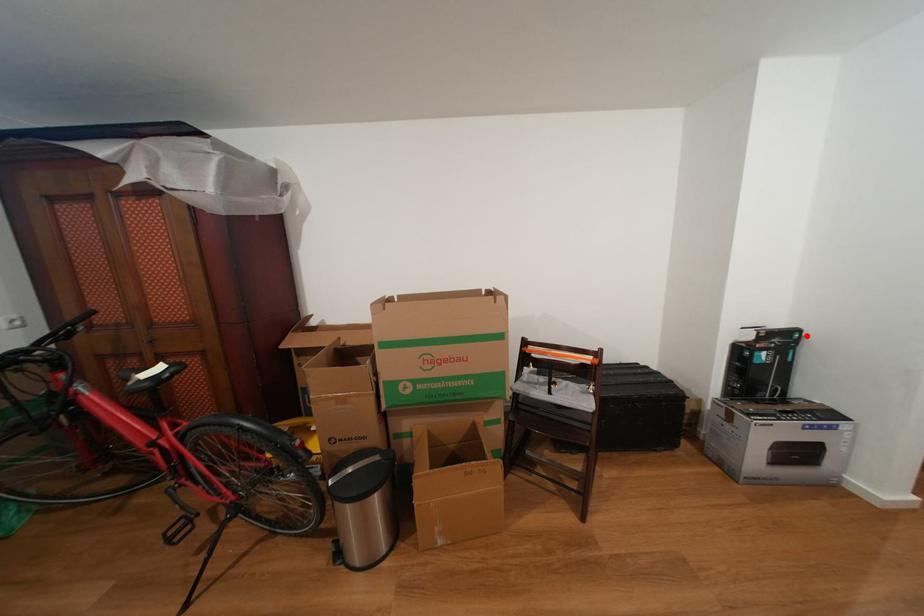
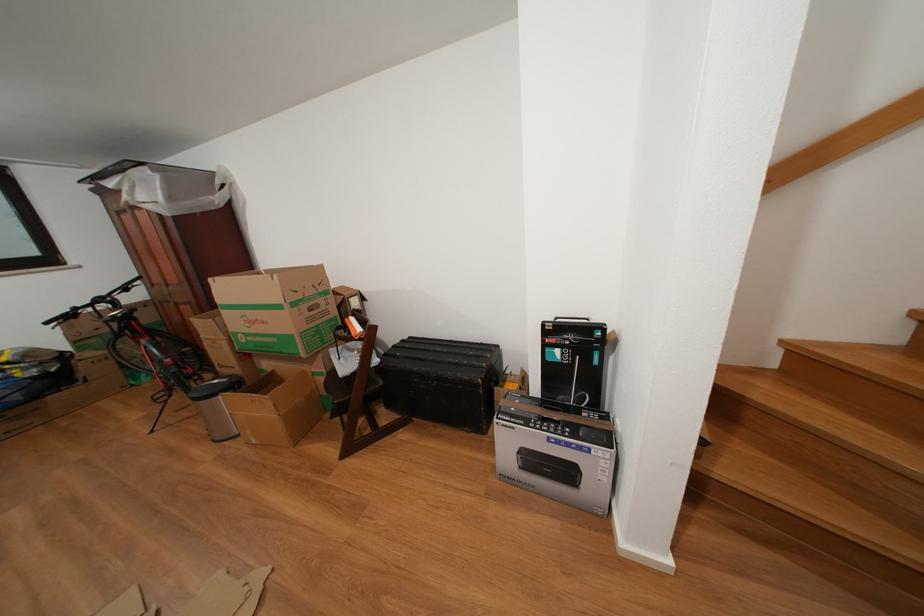
Where in the second image is the point corresponding to the highlighted location from the first image?

(611, 333)